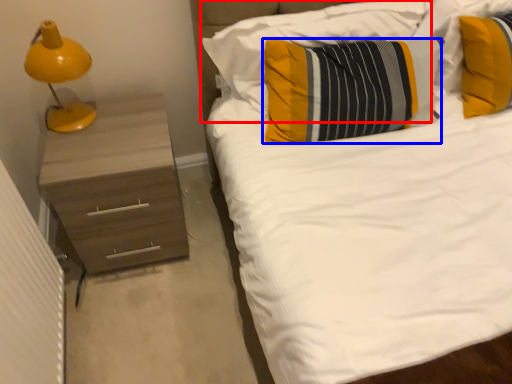
Question: Which object is further to the camera taking this photo, pillow (highlighted by a red box) or pillow (highlighted by a blue box)?

Choices:
 (A) pillow
 (B) pillow

Answer: (A)